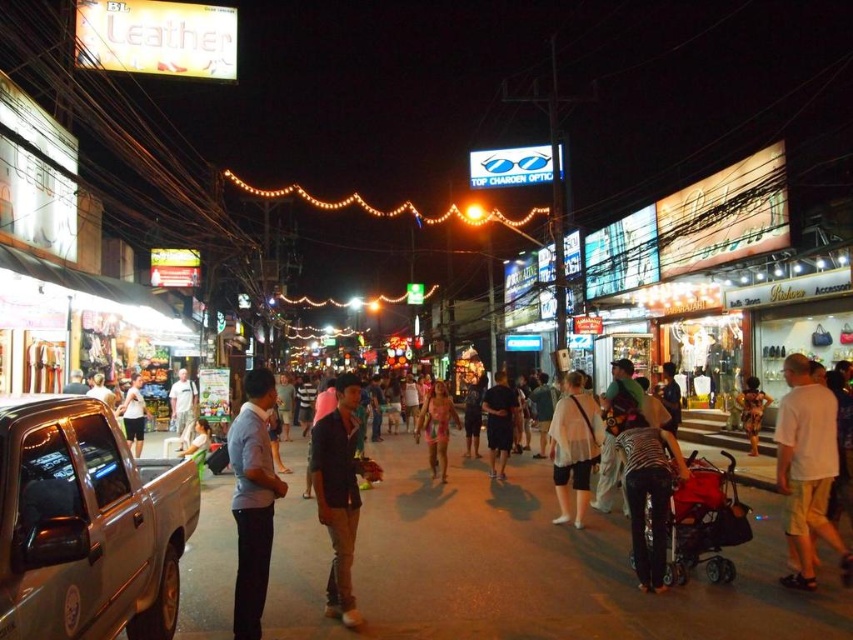
Is point (248, 397) closer to viewer compared to point (444, 458)?

Yes, point (248, 397) is closer to viewer.

Between point (257, 628) and point (421, 424), which one is positioned behind?

Point (421, 424)

The image size is (853, 640). In order to click on gray smooth shirt at center in this screenshot , I will do `click(252, 499)`.

Between point (335, 467) and point (194, 456), which one is positioned in front?

Point (335, 467)

Where is `dark blue shirt at center`? This screenshot has width=853, height=640. dark blue shirt at center is located at coordinates (338, 492).

Between point (338, 596) and point (199, 435), which one is positioned in front?

Point (338, 596) is more forward.

Find the location of a particular element. dark blue shirt at center is located at coordinates point(338,492).

Is point (349, 484) less distant than point (747, 385)?

Yes, point (349, 484) is closer to viewer.

Who is more distant from viewer, (338, 508) or (763, 406)?

The point (763, 406) is more distant.

Where is `dark blue shirt at center`? This screenshot has height=640, width=853. dark blue shirt at center is located at coordinates (338, 492).